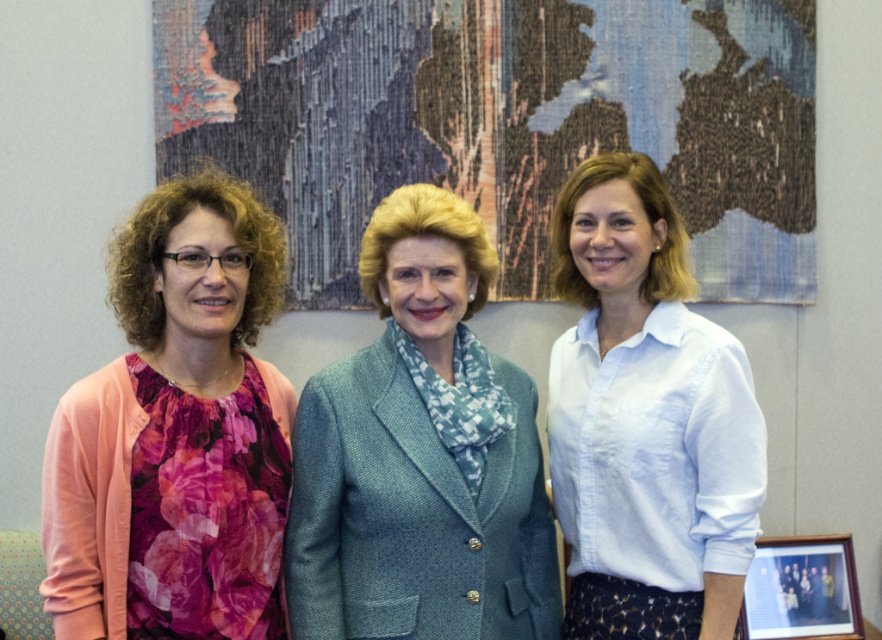
You are an interior designer planning to hang two decorative items in a hallway. The hallway has limited space between two doors that are 36 inches apart. You have the textured fabric map at upper center and the wooden picture frame at lower right from the image. Can these two items be placed between the doors without overlapping?

The distance between the textured fabric map at upper center and the wooden picture frame at lower right is 30.83 inches, which is less than the 36 inches available between the doors. Therefore, these two items can be placed between the doors without overlapping.

You are standing in front of the three women and want to place a small vase on the textured fabric map at upper center. Based on their positions, can you determine if the vase will fit on the map without being obscured by the women?

The textured fabric map at upper center is located at point [501,120], so the vase can be placed there as it is positioned above the women and not obstructed by them.

Consider the image. You are an interior designer planning to hang two items on a wall. You have the textured fabric map at upper center and the wooden picture frame at lower right. Based on their sizes, which item would require more wall space?

The textured fabric map at upper center requires more wall space because it has a larger size compared to the wooden picture frame at lower right.